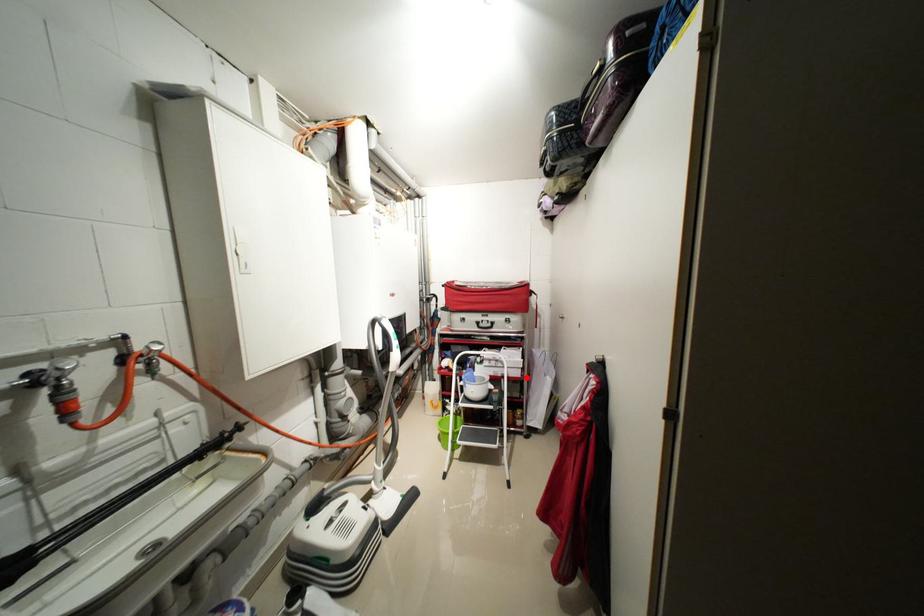
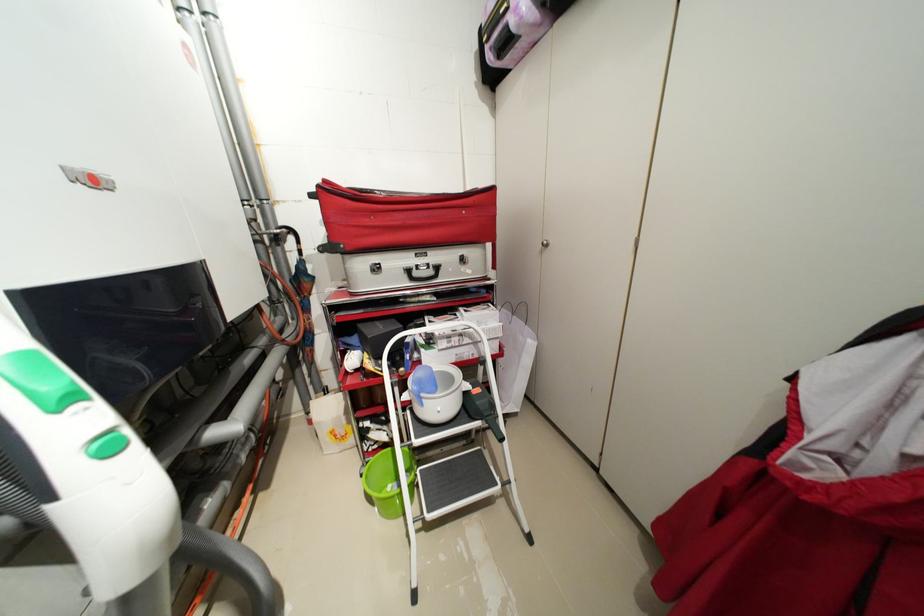
Question: I am providing you with two images of the same scene from different viewpoints. Given a red point in image1, look at the same physical point in image2. Is it:

Choices:
 (A) Closer to the viewpoint
 (B) Farther from the viewpoint

Answer: (A)